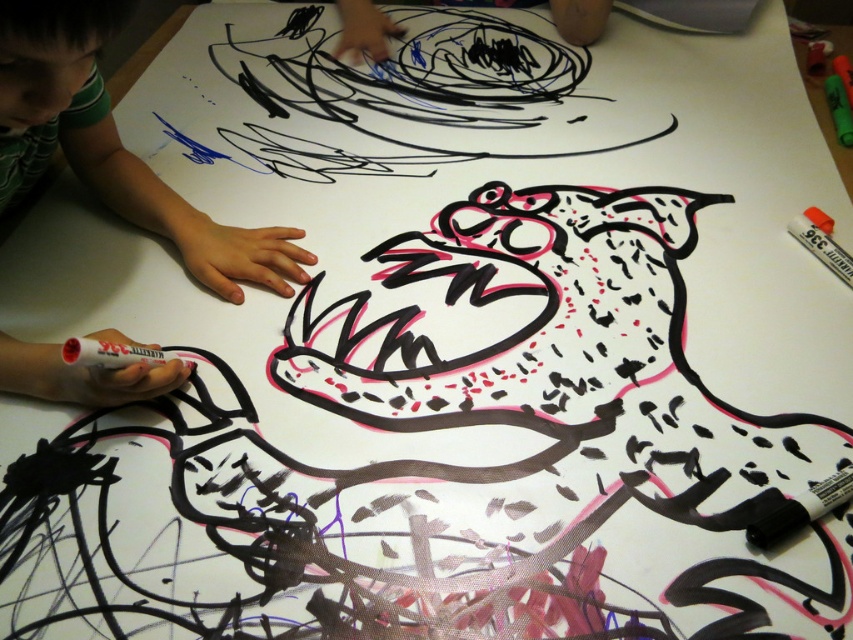
Question: Does green matte skin at upper left have a larger size compared to white matte marker at upper right?

Choices:
 (A) no
 (B) yes

Answer: (B)

Question: Is white matte sharpie at lower left below white matte marker at upper right?

Choices:
 (A) yes
 (B) no

Answer: (A)

Question: Is white matte sharpie at lower left to the left of white matte marker at upper right from the viewer's perspective?

Choices:
 (A) yes
 (B) no

Answer: (A)

Question: Among these objects, which one is nearest to the camera?

Choices:
 (A) green matte skin at upper left
 (B) white matte sharpie at lower left
 (C) white matte marker at upper right

Answer: (A)

Question: Estimate the real-world distances between objects in this image. Which object is farther from the white matte marker at upper right?

Choices:
 (A) white matte sharpie at lower left
 (B) green matte skin at upper left

Answer: (B)

Question: Which point appears closest to the camera in this image?

Choices:
 (A) (143, 392)
 (B) (821, 240)

Answer: (A)